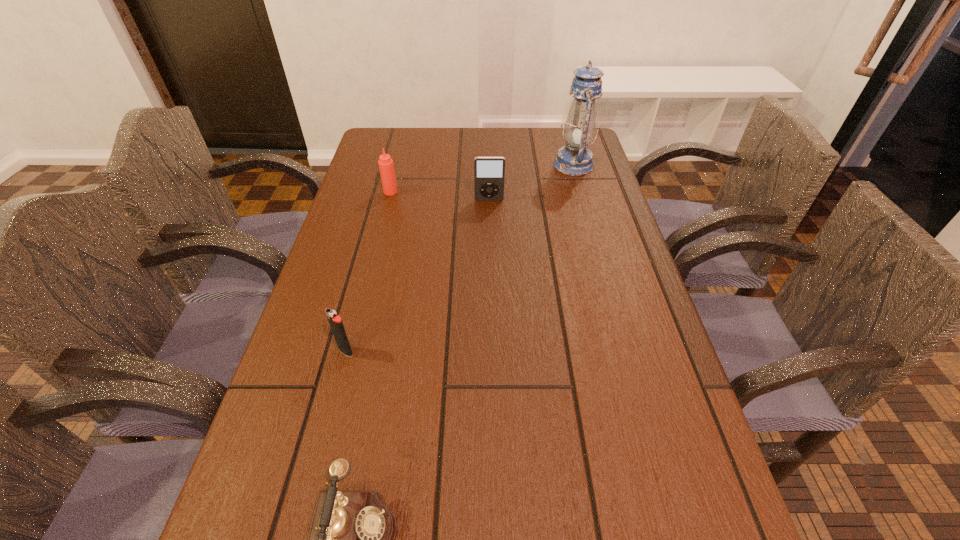
Identify the location of the farthest object. Image resolution: width=960 pixels, height=540 pixels. (575, 159).

Identify the location of the tallest object. (575, 159).

The image size is (960, 540). What are the coordinates of `Tabasco sauce` in the screenshot? It's located at click(386, 167).

Find the location of `the third nearest object`. the third nearest object is located at coordinates [x=489, y=172].

The width and height of the screenshot is (960, 540). I want to click on the second object from right to left, so click(x=489, y=172).

The width and height of the screenshot is (960, 540). In order to click on igniter in this screenshot , I will do `click(336, 324)`.

Where is `vacant space located on the front-facing side of the lantern`? The width and height of the screenshot is (960, 540). vacant space located on the front-facing side of the lantern is located at coordinates (472, 165).

Locate an element on the screen. vacant point located on the front-facing side of the lantern is located at coordinates (459, 165).

What are the coordinates of `free spot located on the front-facing side of the lantern` in the screenshot? It's located at (517, 165).

Find the location of a particular element. The height and width of the screenshot is (540, 960). vacant space located 0.170m on the front of the second farthest object is located at coordinates (380, 234).